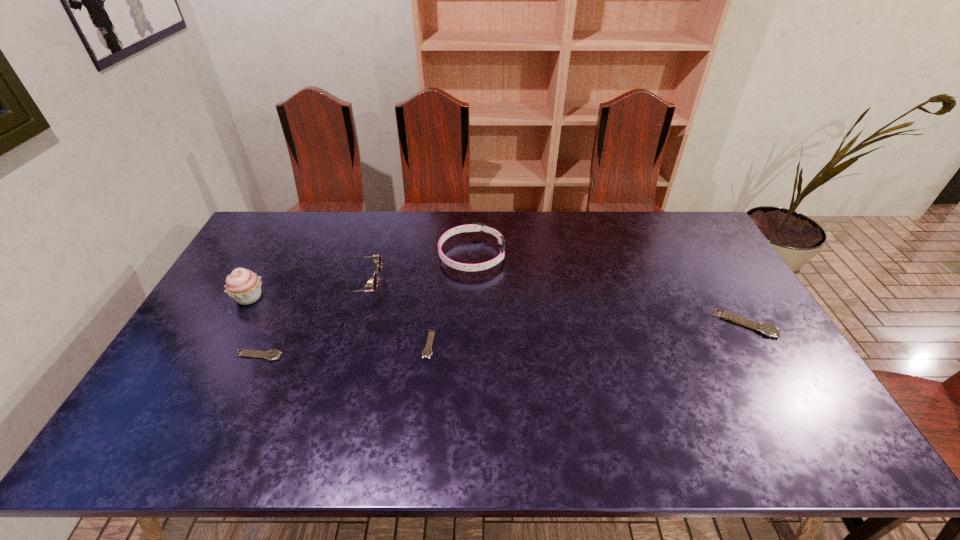
Image resolution: width=960 pixels, height=540 pixels. I want to click on vacant space that satisfies the following two spatial constraints: 1. with the buckle on the third tallest object; 2. on the left side of the rightmost object, so click(x=470, y=323).

I want to click on free spot that satisfies the following two spatial constraints: 1. on the front lenses of the fifth shortest object; 2. on the front side of the second shortest object, so click(x=337, y=356).

Where is `free region that satisfies the following two spatial constraints: 1. on the back side of the fourth tallest object; 2. with the buckle on the dog collar`? free region that satisfies the following two spatial constraints: 1. on the back side of the fourth tallest object; 2. with the buckle on the dog collar is located at coordinates (705, 255).

The image size is (960, 540). In order to click on free location that satisfies the following two spatial constraints: 1. on the back side of the second watch from left to right; 2. on the front lenses of the second tallest object in this screenshot , I will do [x=435, y=285].

Find the location of a particular element. This screenshot has height=540, width=960. free point that satisfies the following two spatial constraints: 1. on the front lenses of the shortest watch; 2. on the left side of the fifth shortest object is located at coordinates (340, 345).